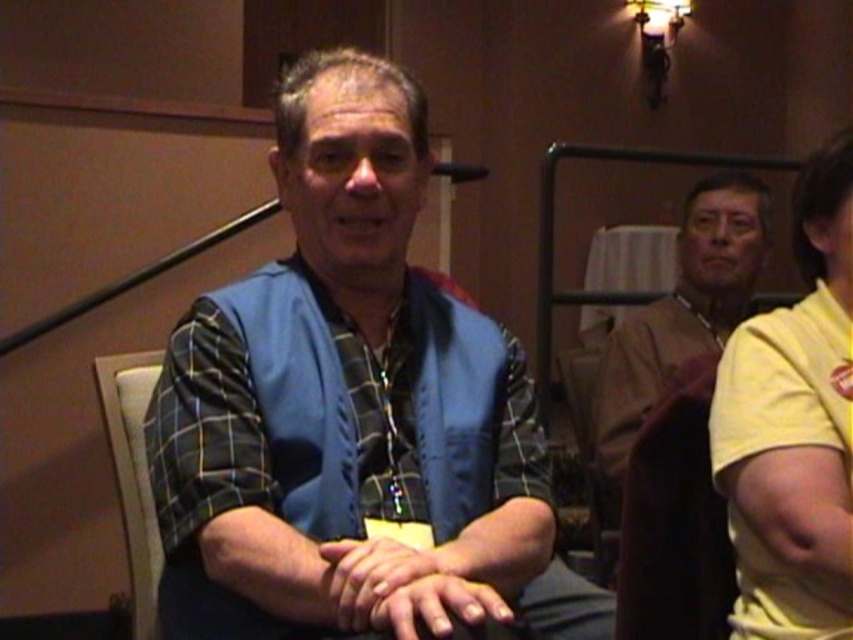
Based on the coordinates provided, which object corresponds to the point at location [793,428] in the scene?

The point at location [793,428] corresponds to the yellow matte shirt at right.

You are planning to place the brown leather jacket at upper right onto the light beige fabric chair at lower left. Based on their sizes, will the jacket fit without hanging off the edges?

The brown leather jacket at upper right might be wider than light beige fabric chair at lower left, so there is a possibility that the jacket will hang off the edges of the chair.